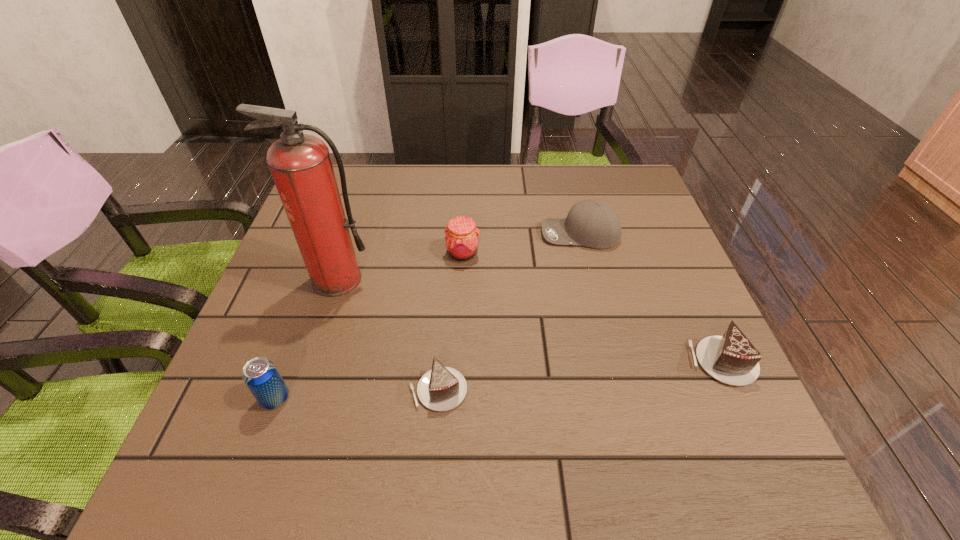
Locate an element on the screen. This screenshot has height=540, width=960. the shortest object is located at coordinates (443, 388).

You are a GUI agent. You are given a task and a screenshot of the screen. Output one action in this format:
    pyautogui.click(x=<x>, y=<y>)
    Task: Click on the left chocolate cake
    
    Given the screenshot: What is the action you would take?
    click(x=443, y=388)

You are a GUI agent. You are given a task and a screenshot of the screen. Output one action in this format:
    pyautogui.click(x=<x>, y=<y>)
    Task: Click on the right chocolate cake
    The image size is (960, 540).
    Given the screenshot: What is the action you would take?
    pyautogui.click(x=732, y=359)

The width and height of the screenshot is (960, 540). What are the coordinates of `the fifth tallest object` in the screenshot? It's located at (732, 359).

Where is `the second object from right to left`? The image size is (960, 540). the second object from right to left is located at coordinates (590, 223).

Identify the location of fire extinguisher. Image resolution: width=960 pixels, height=540 pixels. (300, 164).

This screenshot has height=540, width=960. In order to click on jam in this screenshot , I will do `click(461, 237)`.

Identify the location of beer can. The image size is (960, 540). (261, 376).

Image resolution: width=960 pixels, height=540 pixels. Identify the location of vacant point located 0.310m on the right of the left chocolate cake. (636, 390).

The image size is (960, 540). I want to click on free space located 0.080m on the left of the right chocolate cake, so click(649, 362).